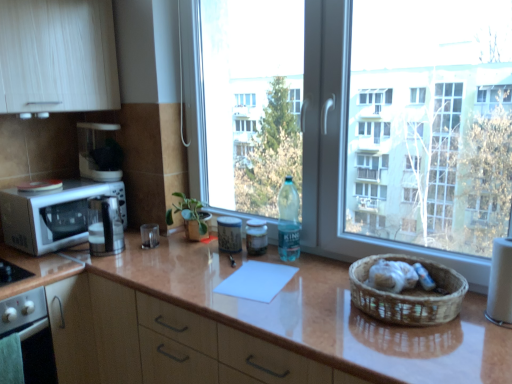
Find the location of a particular element. The height and width of the screenshot is (384, 512). free space to the left of transparent glass window at center is located at coordinates point(200,268).